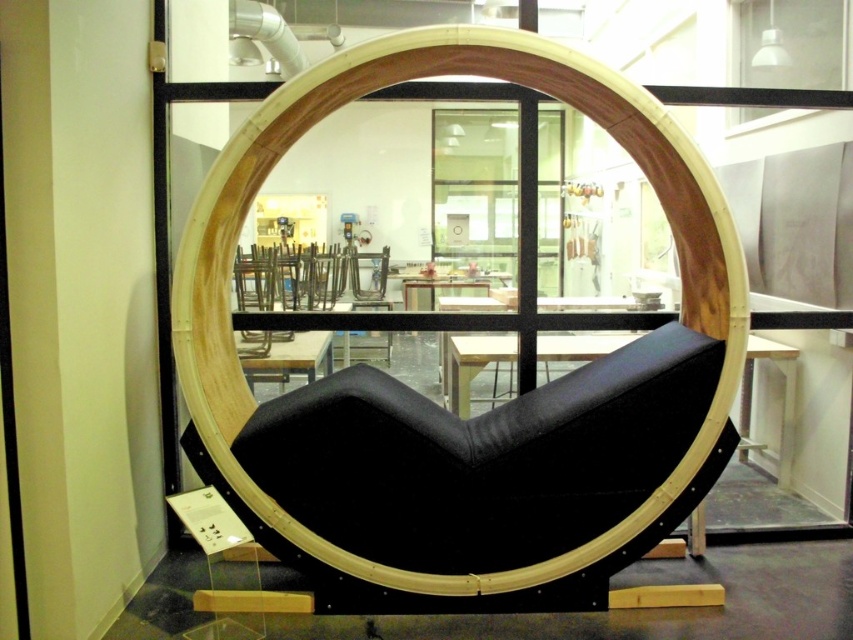
You are standing in front of the circular furniture piece and want to place a decorative item between the two points labeled point (743, 12) and point (325, 333). Based on their positions, which point should the decorative item be closer to?

The decorative item should be placed closer to point (325, 333) because point (743, 12) is in front of it, meaning the latter is further back.

You are standing in front of the circular furniture and want to see the view outside through the transparent glass window at upper center. However, there is a matte black table at center in the way. Can you see the window without moving the table?

The transparent glass window at upper center is closer to the viewer than the matte black table at center, so yes, you can see the window without moving the table because it is in front of the table.

You are designing a layout for a small living room and need to place both the black fabric cushion at center and the black matte table at center. Given their sizes, which object should you prioritize placing first to ensure proper spacing?

The black fabric cushion at center has a larger size compared to the black matte table at center, so you should prioritize placing the black fabric cushion at center first to ensure proper spacing.